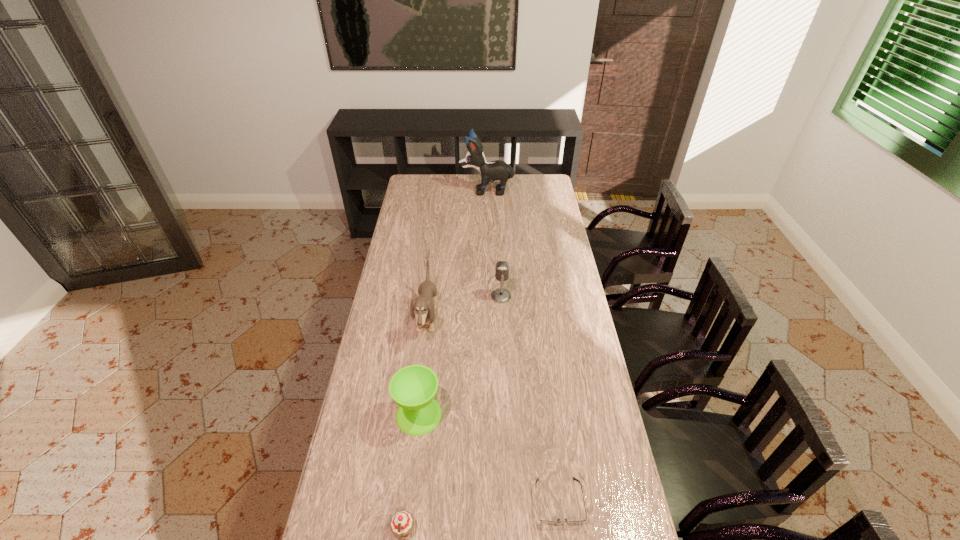
This screenshot has height=540, width=960. I want to click on the right puppy, so click(x=495, y=170).

This screenshot has width=960, height=540. I want to click on the farther puppy, so click(495, 170).

You are a GUI agent. You are given a task and a screenshot of the screen. Output one action in this format:
    pyautogui.click(x=<x>, y=<y>)
    Task: Click on the nearer puppy
    This screenshot has width=960, height=540.
    Given the screenshot: What is the action you would take?
    pyautogui.click(x=423, y=306)

The width and height of the screenshot is (960, 540). I want to click on the left puppy, so click(x=423, y=306).

This screenshot has height=540, width=960. Identify the location of microphone. (500, 295).

Locate an element on the screen. The width and height of the screenshot is (960, 540). the third nearest object is located at coordinates (413, 388).

Identify the location of spectacles. (558, 520).

You are a GUI agent. You are given a task and a screenshot of the screen. Output one action in this format:
    pyautogui.click(x=<x>, y=<y>)
    Task: Click on the vacant space located on the front-facing side of the farthest object
    
    Given the screenshot: What is the action you would take?
    pyautogui.click(x=424, y=191)

What are the coordinates of `free spot located on the front-facing side of the farthest object` in the screenshot? It's located at (435, 191).

This screenshot has height=540, width=960. What are the coordinates of `vacant point located 0.110m on the front-facing side of the farthest object` in the screenshot? It's located at (441, 191).